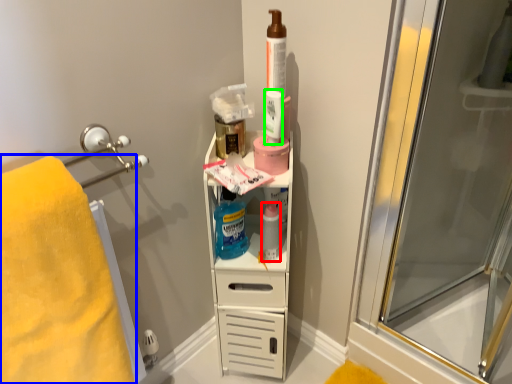
Question: Which object is positioned farthest from mouthwash (highlighted by a red box)? Select from towel (highlighted by a blue box) and mouthwash (highlighted by a green box).

Choices:
 (A) towel
 (B) mouthwash

Answer: (A)